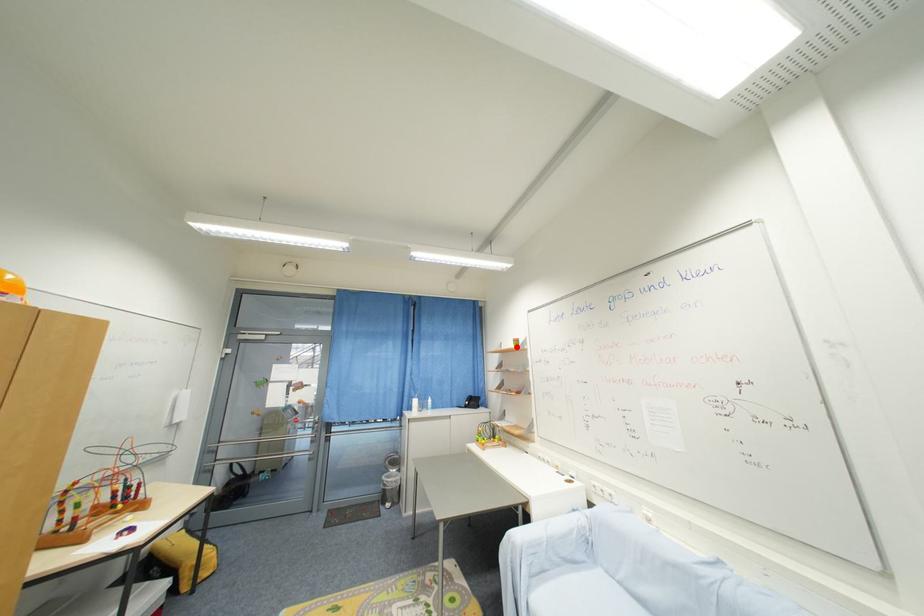
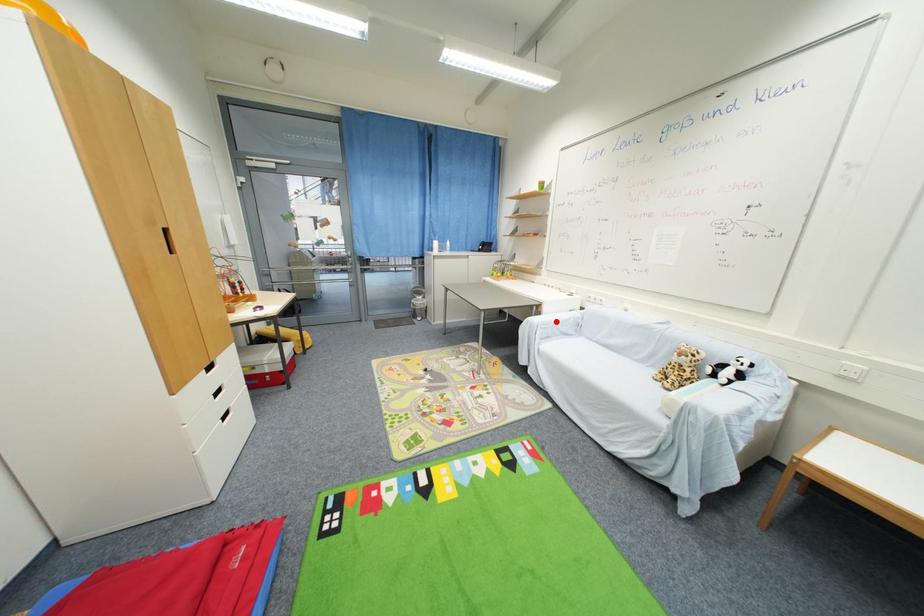
I am providing you with two images of the same scene from different viewpoints. A red point is marked on the first image and another point is marked on the second image. Does the point marked in image1 correspond to the same location as the one in image2?

No